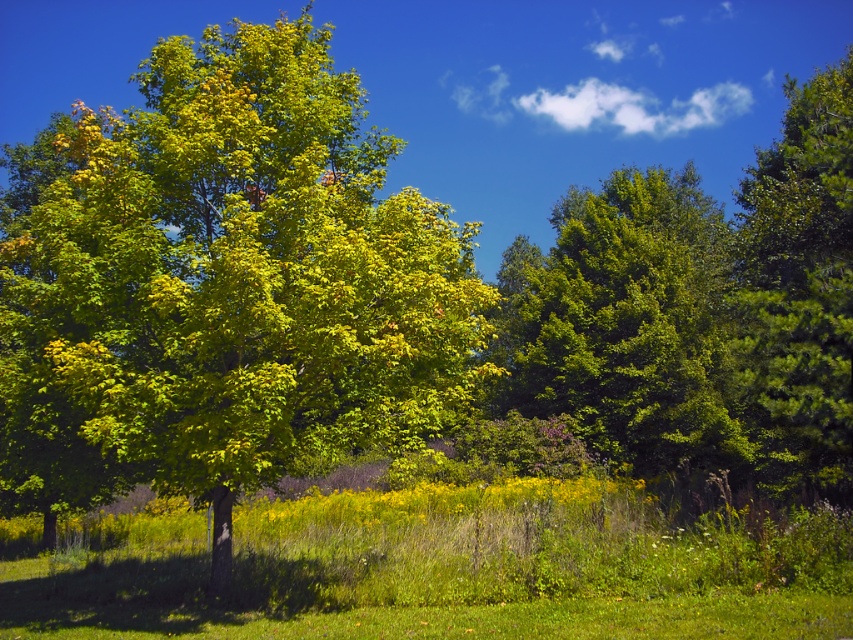
Question: Is green leafy tree at center wider than green matte tree at right?

Choices:
 (A) no
 (B) yes

Answer: (A)

Question: Can you confirm if green leafy tree at center is thinner than green matte tree at right?

Choices:
 (A) yes
 (B) no

Answer: (A)

Question: Which object appears farthest from the camera in this image?

Choices:
 (A) green leafy tree at center
 (B) green matte tree at right

Answer: (B)

Question: Does green leafy tree at center appear under green matte tree at right?

Choices:
 (A) yes
 (B) no

Answer: (A)